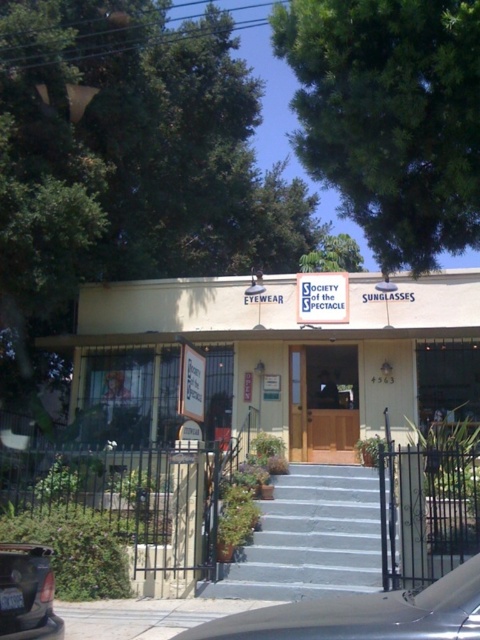
Question: Is the position of beige wooden door at center more distant than that of silver metallic car at center?

Choices:
 (A) no
 (B) yes

Answer: (B)

Question: Based on their relative distances, which object is nearer to the matte black car at lower left?

Choices:
 (A) beige wooden door at center
 (B) gray concrete stairs at center

Answer: (B)

Question: Which object is farther from the camera taking this photo?

Choices:
 (A) silver metallic car at center
 (B) beige wooden door at center
 (C) wooden door at center
 (D) matte black car at lower left

Answer: (C)

Question: Does wooden door at center come in front of matte black car at lower left?

Choices:
 (A) no
 (B) yes

Answer: (A)

Question: Is the position of beige wooden door at center less distant than that of gray concrete stairs at center?

Choices:
 (A) no
 (B) yes

Answer: (A)

Question: Considering the real-world distances, which object is farthest from the matte black car at lower left?

Choices:
 (A) wooden door at center
 (B) beige wooden door at center
 (C) silver metallic car at center

Answer: (A)